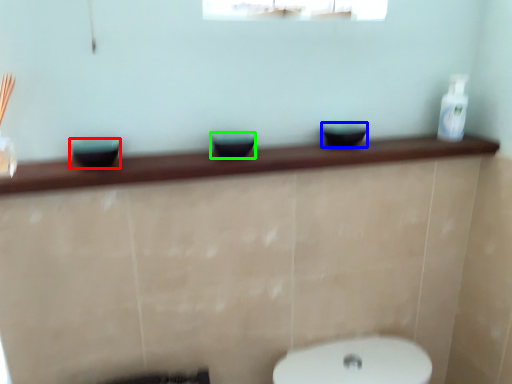
Question: Which object is positioned closest to basin (highlighted by a red box)? Select from basin (highlighted by a blue box) and basin (highlighted by a green box).

Choices:
 (A) basin
 (B) basin

Answer: (B)